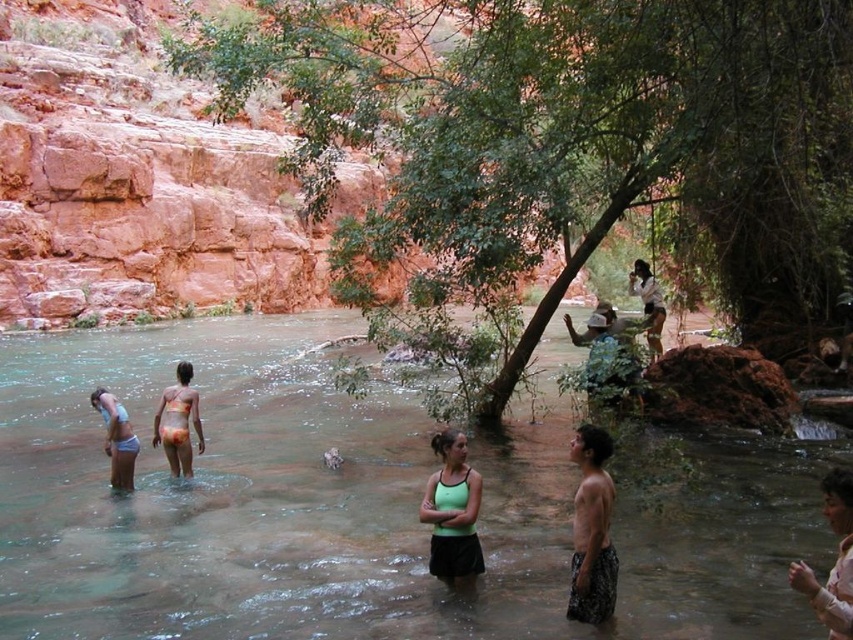
You are a photographer taking pictures of the green matte tank top at center and the white cotton shirt at upper center. Which clothing item is located lower in the image?

The green matte tank top at center is positioned under the white cotton shirt at upper center, so it is lower in the image.

You are a photographer trying to capture a candid shot of the dark brown textured shorts at lower right and the printed fabric bikini at center. Since you want to include both in the frame, which object should you focus on first to ensure they are both in focus?

You should focus on the printed fabric bikini at center first because it is taller than the dark brown textured shorts at lower right, so focusing on the taller object will help keep both in focus.

You are standing at the edge of the river and notice the point marked at coordinates (115, 438). What object is located at that point?

The point marked at coordinates (115, 438) is where the light blue bikini at lower left is located.